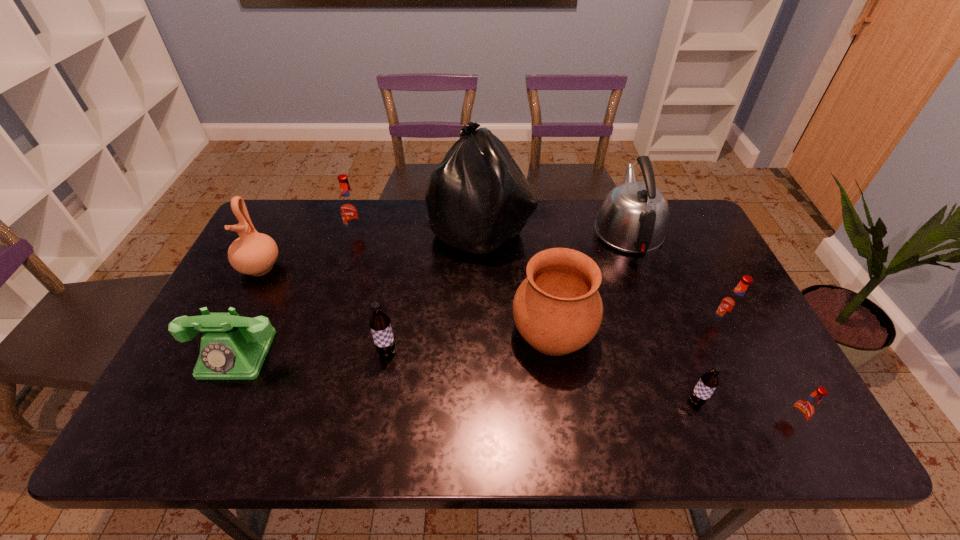
Where is `empty location between the third object from left to right and the left pottery`? The width and height of the screenshot is (960, 540). empty location between the third object from left to right and the left pottery is located at coordinates (308, 251).

Locate an element on the screen. The image size is (960, 540). unoccupied position between the green telephone and the rightmost root beer is located at coordinates (514, 388).

Locate an element on the screen. This screenshot has height=540, width=960. empty space between the fourth nearest root beer and the right pottery is located at coordinates (636, 329).

The height and width of the screenshot is (540, 960). I want to click on free spot between the plastic bag and the leftmost root beer, so click(419, 232).

Identify the location of unoccupied position between the nearer pottery and the second object from right to left. (636, 329).

Locate an element on the screen. This screenshot has height=540, width=960. vacant point located between the plastic bag and the left pottery is located at coordinates (371, 248).

Locate an element on the screen. vacant space that is in between the farther pottery and the plastic bag is located at coordinates (371, 248).

In order to click on free space between the nearer pottery and the plastic bag in this screenshot , I will do `click(516, 280)`.

Identify the location of the third closest object to the left pottery. Image resolution: width=960 pixels, height=540 pixels. (379, 323).

Find the location of a particular element. The image size is (960, 540). the seventh closest object to the ninth object from left to right is located at coordinates (350, 209).